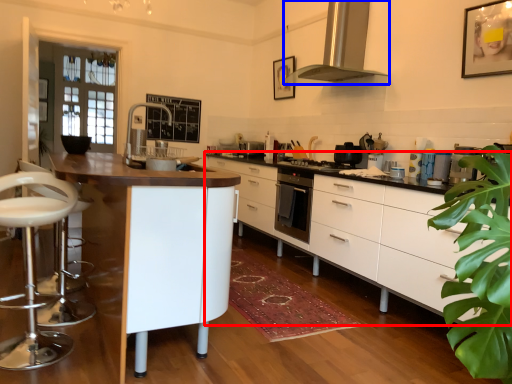
Question: Which point is closer to the camera, cabinetry (highlighted by a red box) or home appliance (highlighted by a blue box)?

Choices:
 (A) cabinetry
 (B) home appliance

Answer: (A)